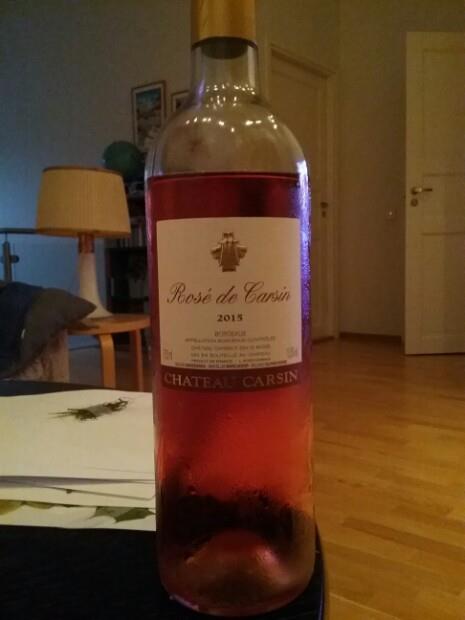
At what (x,y) coordinates should I click in order to perform the action: click on right end of couch. Please return your answer as a coordinate pair (x, y). This screenshot has height=620, width=465. Looking at the image, I should click on (59, 363).